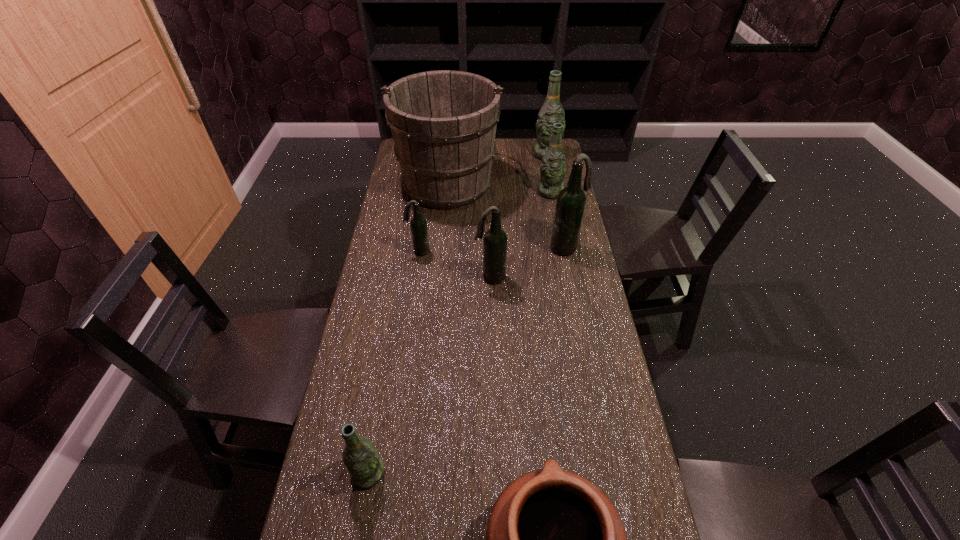
Choose which beer bottle is the second nearest neighbor to the leftmost green beer bottle. Please provide its 2D coordinates. Your answer should be formatted as a tuple, i.e. [(x, y)], where the tuple contains the x and y coordinates of a point satisfying the conditions above.

[(418, 224)]

Where is `beer bottle object that ranks as the second closest to the reddish pottery`? beer bottle object that ranks as the second closest to the reddish pottery is located at coordinates (495, 239).

Locate which green beer bottle ranks second in proximity to the nearest beer bottle. Please provide its 2D coordinates. Your answer should be formatted as a tuple, i.e. [(x, y)], where the tuple contains the x and y coordinates of a point satisfying the conditions above.

[(552, 111)]

The image size is (960, 540). What are the coordinates of `green beer bottle that is the second nearest to the bucket` in the screenshot? It's located at (552, 111).

I want to click on dark beer bottle identified as the third closest to the reddish pottery, so click(x=418, y=224).

The height and width of the screenshot is (540, 960). Identify the location of dark beer bottle that is the closest to the reddish pottery. (495, 239).